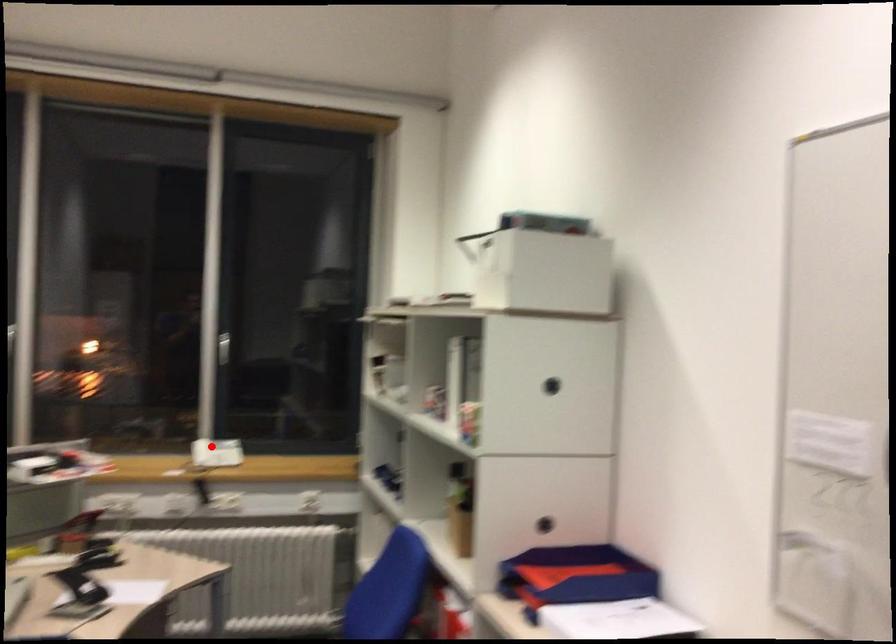
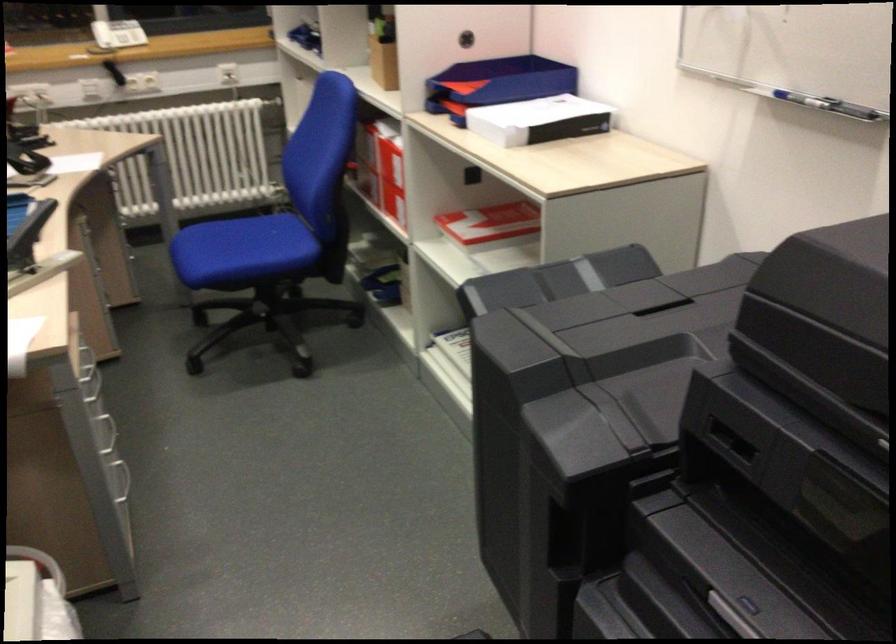
Question: I am providing you with two images of the same scene from different viewpoints. A red point is marked on the first image. Is the red point's position out of view in image 2?

Choices:
 (A) Yes
 (B) No

Answer: (B)